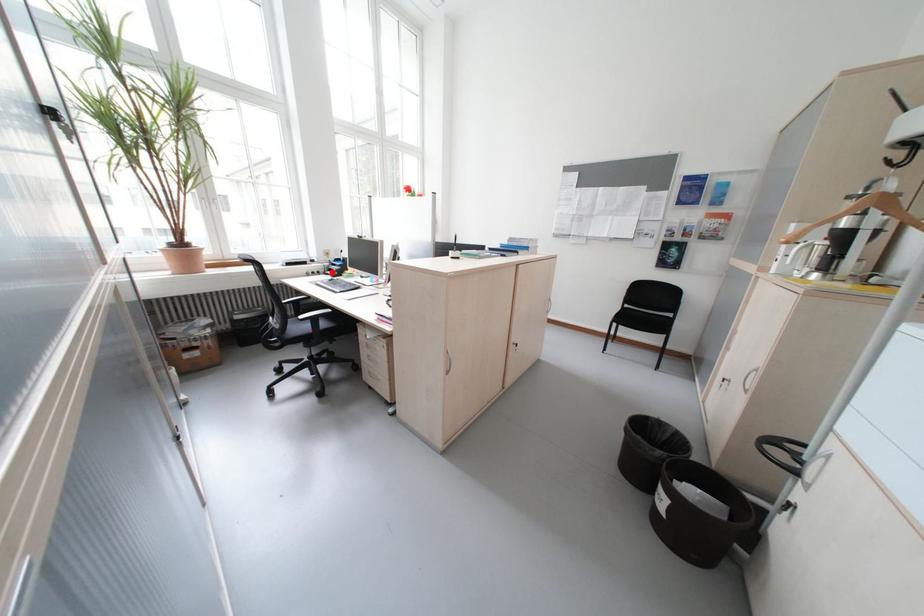
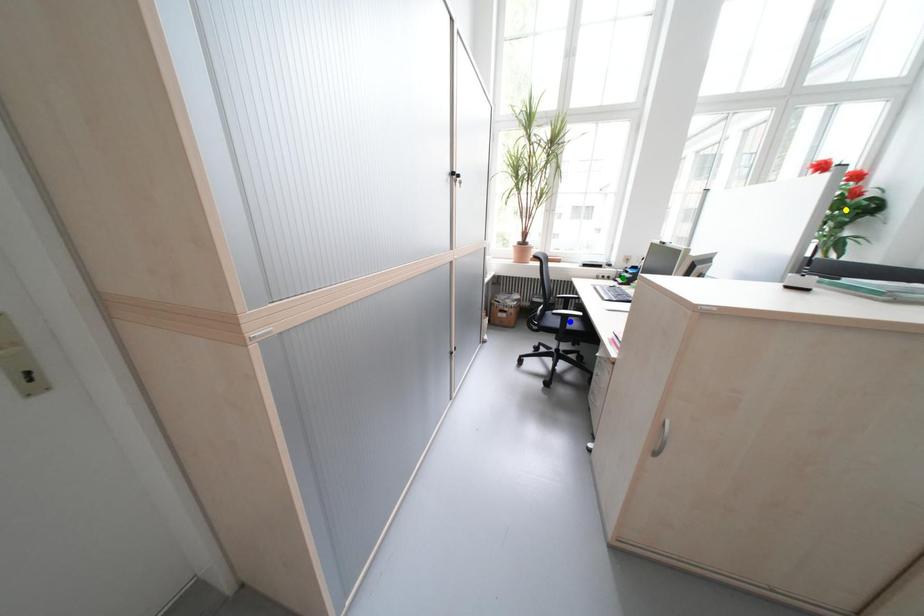
Question: I am providing you with two images of the same scene from different viewpoints. A red point is marked on the first image. You are given multiple points on the second image. Which spot in image 2 lines up with the point in image 1?

Choices:
 (A) yellow point
 (B) green point
 (C) blue point

Answer: (B)